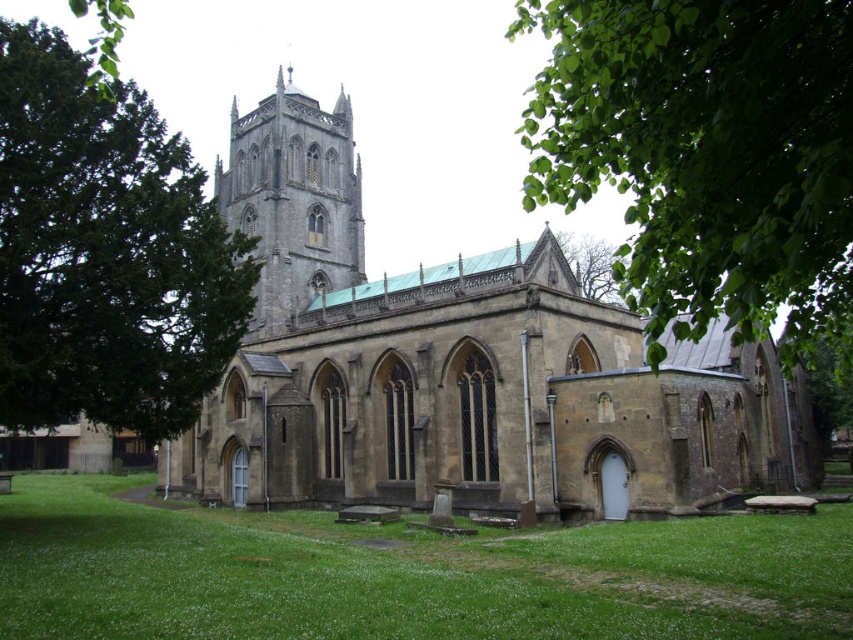
You are standing at the entrance of the historic stone church and want to take a photo of the point located at coordinates point [403,525]. The camera you have can focus on objects within 200 feet. Will the camera be able to focus on the point?

The distance of point [403,525] from camera is 216.33 feet, which is beyond the camera focus range of 200 feet. Therefore, the camera will not be able to focus on the point.

Based on the photo, you are standing in front of the historic stone church and notice two points on the roof. The first point is at coordinates point (670, 449) and the second is at point (317, 227). If you want to place a decorative flag closer to the camera, which point should you choose?

Point (670, 449) is closer to the camera than point (317, 227), so you should place the decorative flag at point (670, 449) to ensure it is closer to the camera.

What are the coordinates of the green leafy tree at left?

The green leafy tree at left is located at coordinates point [105,252].